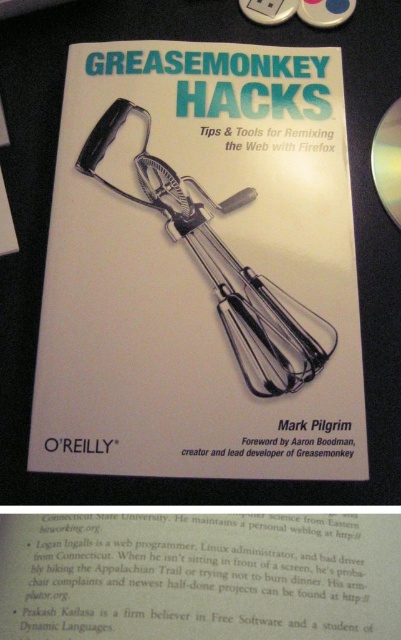
Can you confirm if white paper book at center is smaller than silver metallic dvd at upper right?

Incorrect, white paper book at center is not smaller in size than silver metallic dvd at upper right.

Locate an element on the screen. Image resolution: width=401 pixels, height=640 pixels. white paper book at center is located at coordinates (200, 268).

Which is behind, point (145, 266) or point (380, 200)?

The point (380, 200) is more distant.

The image size is (401, 640). I want to click on white paper book at center, so click(x=200, y=268).